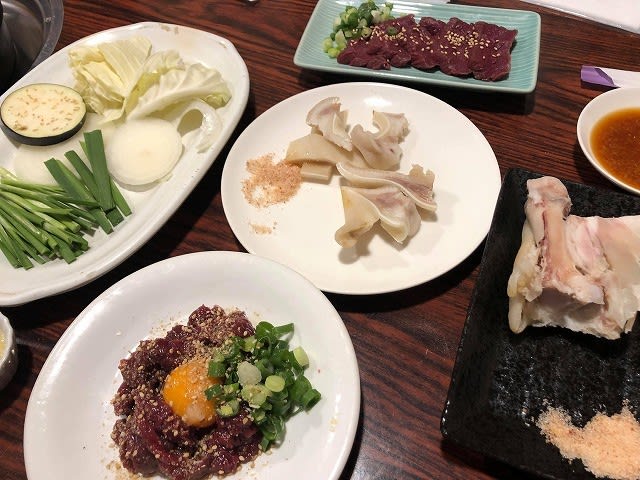
Find the location of a particular element. table is located at coordinates (548, 149).